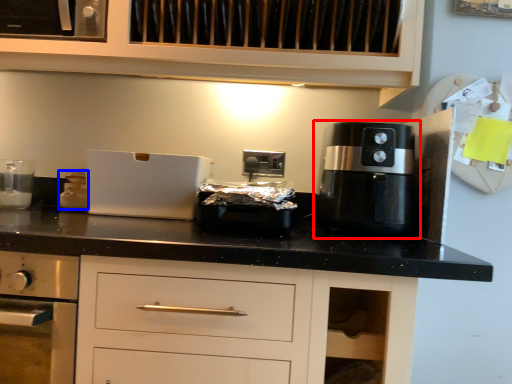
Question: Which object appears closest to the camera in this image, coffee machine (highlighted by a red box) or kitchen appliance (highlighted by a blue box)?

Choices:
 (A) coffee machine
 (B) kitchen appliance

Answer: (A)